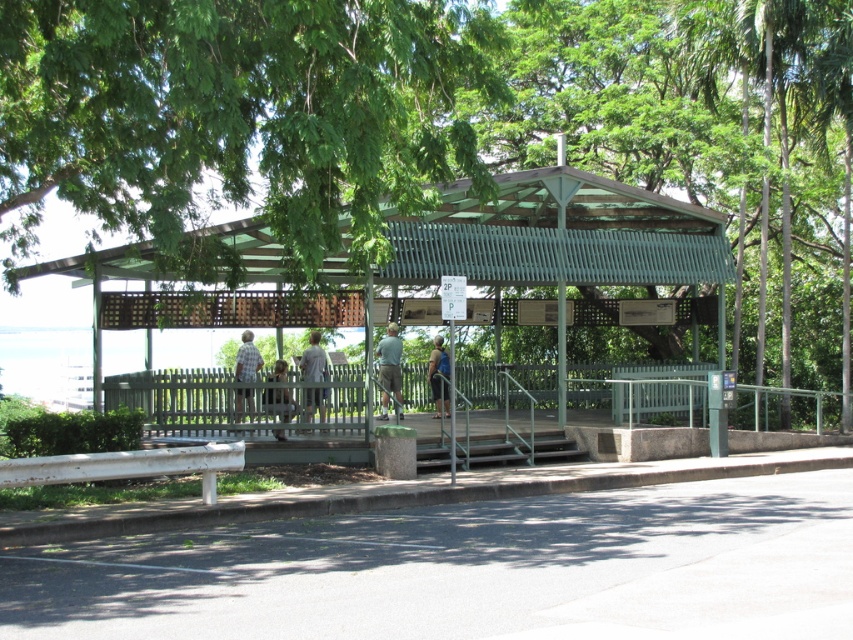
Can you confirm if green leafy tree at upper center is positioned above gray fabric shirt at center?

Yes.

Between point (361, 154) and point (308, 352), which one is positioned in front?

Point (361, 154) is in front.

What are the coordinates of `green leafy tree at upper center` in the screenshot? It's located at (241, 116).

Who is more forward, (392, 384) or (241, 397)?

Point (241, 397) is in front.

Can you confirm if green fabric shirt at center is wider than plaid shirt at center?

Correct, the width of green fabric shirt at center exceeds that of plaid shirt at center.

Who is more forward, (x=384, y=358) or (x=248, y=333)?

Point (x=248, y=333) is in front.

Identify the location of green fabric shirt at center. Image resolution: width=853 pixels, height=640 pixels. (390, 369).

Does point (306, 408) come farther from viewer compared to point (242, 396)?

Yes, point (306, 408) is behind point (242, 396).

Who is more distant from viewer, (321, 376) or (245, 349)?

Positioned behind is point (321, 376).

Does point (320, 397) come farther from viewer compared to point (236, 412)?

Yes, it is.

This screenshot has height=640, width=853. Identify the location of gray fabric shirt at center. (312, 358).